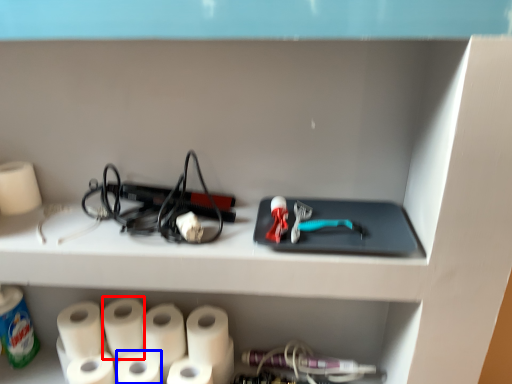
Question: Which object appears closest to the camera in this image, paper towel (highlighted by a red box) or paper towel (highlighted by a blue box)?

Choices:
 (A) paper towel
 (B) paper towel

Answer: (B)